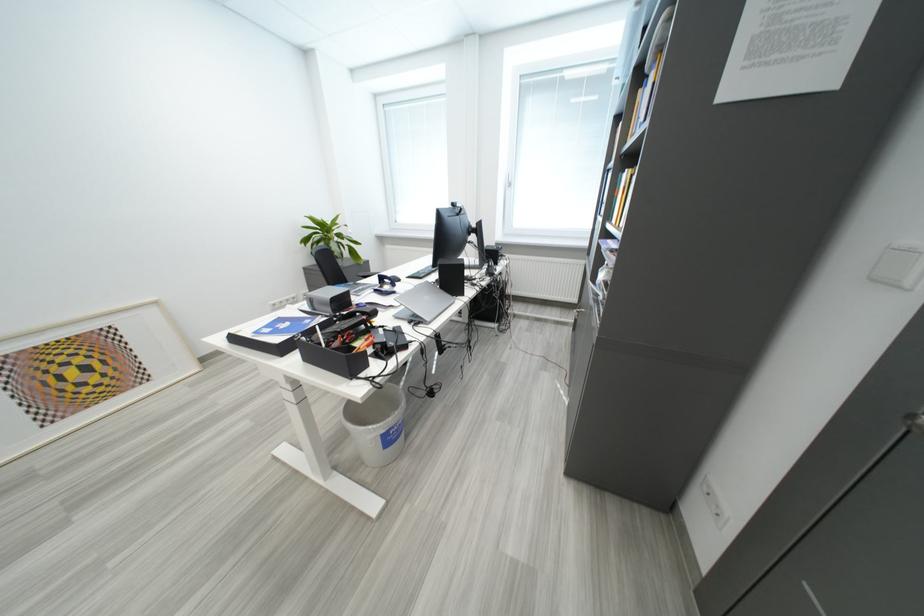
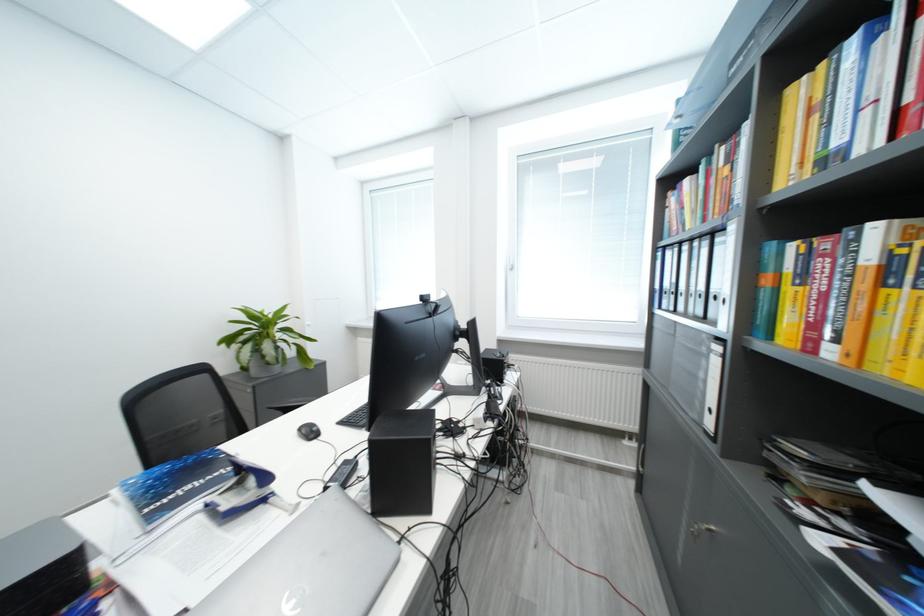
Question: Based on the continuous images, in which direction is the camera rotating? Reply with the corresponding letter.

Choices:
 (A) Left
 (B) Right
 (C) Up
 (D) Down

Answer: (C)